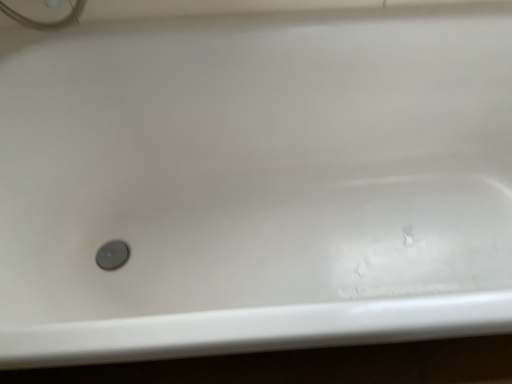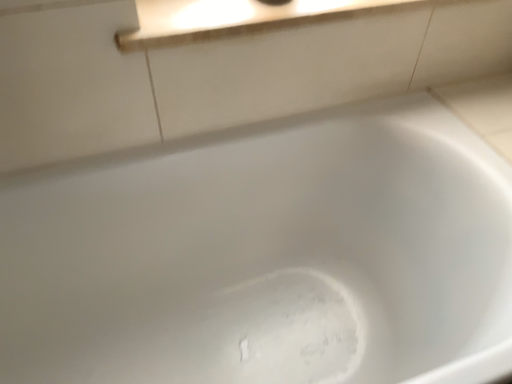
Question: How did the camera likely rotate when shooting the video?

Choices:
 (A) rotated right
 (B) rotated left

Answer: (A)